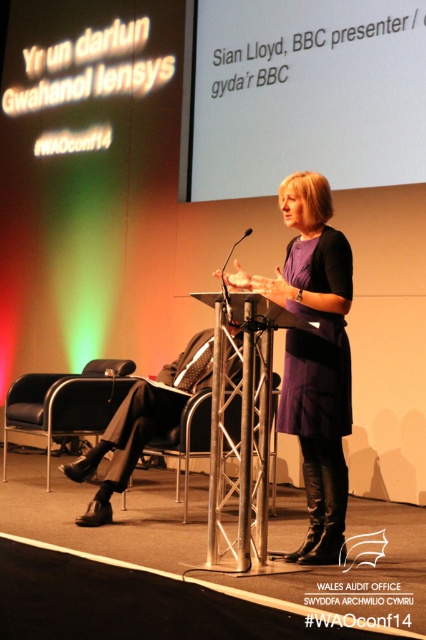
Does point (319, 288) come farther from viewer compared to point (48, 397)?

No, (319, 288) is in front of (48, 397).

Is purple matte dress at center to the left of black leather chair at lower left from the viewer's perspective?

In fact, purple matte dress at center is to the right of black leather chair at lower left.

Which is behind, point (247, 282) or point (92, 369)?

The point (92, 369) is behind.

Identify the location of purple matte dress at center. The image size is (426, 640). (313, 356).

Between metallic silver podium at center and black leather chair at lower left, which one is positioned higher?

black leather chair at lower left is above.

Looking at this image, is metallic silver podium at center smaller than black leather chair at lower left?

Incorrect, metallic silver podium at center is not smaller in size than black leather chair at lower left.

I want to click on metallic silver podium at center, so click(241, 429).

Which of these two, metallic silver podium at center or metallic silver chair at center, stands shorter?

metallic silver chair at center is shorter.

Between metallic silver podium at center and metallic silver chair at center, which one is positioned higher?

metallic silver podium at center is higher up.

What are the coordinates of `metallic silver podium at center` in the screenshot? It's located at (241, 429).